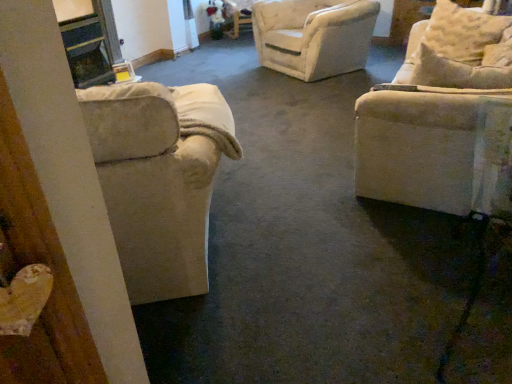
Question: Should I look upward or downward to see beige fabric pillow at upper right?

Choices:
 (A) up
 (B) down

Answer: (A)

Question: Can you confirm if beige fabric couch at right, positioned as the second chair in left-to-right order, is wider than beige fabric pillow at upper right?

Choices:
 (A) no
 (B) yes

Answer: (A)

Question: Does beige fabric couch at right, acting as the first chair starting from the right, turn towards beige fabric pillow at upper right?

Choices:
 (A) no
 (B) yes

Answer: (B)

Question: Is beige fabric couch at right, positioned as the second chair in left-to-right order, to the left of beige fabric pillow at upper right from the viewer's perspective?

Choices:
 (A) no
 (B) yes

Answer: (B)

Question: From a real-world perspective, is beige fabric couch at right, positioned as the second chair in left-to-right order, on top of beige fabric pillow at upper right?

Choices:
 (A) no
 (B) yes

Answer: (B)

Question: Does beige fabric couch at right, acting as the first chair starting from the right, have a smaller size compared to beige fabric pillow at upper right?

Choices:
 (A) yes
 (B) no

Answer: (A)

Question: Is beige fabric couch at right, positioned as the second chair in left-to-right order, located outside beige fabric pillow at upper right?

Choices:
 (A) yes
 (B) no

Answer: (A)

Question: Can you confirm if beige fabric couch at right, acting as the first chair starting from the right, is wider than beige fabric armchair at left, which is the first chair in left-to-right order?

Choices:
 (A) no
 (B) yes

Answer: (A)

Question: From the image's perspective, is beige fabric couch at right, acting as the first chair starting from the right, on beige fabric armchair at left, marked as the second chair in a right-to-left arrangement?

Choices:
 (A) yes
 (B) no

Answer: (A)

Question: Are beige fabric couch at right, acting as the first chair starting from the right, and beige fabric armchair at left, marked as the second chair in a right-to-left arrangement, located far from each other?

Choices:
 (A) no
 (B) yes

Answer: (B)

Question: Is beige fabric couch at right, positioned as the second chair in left-to-right order, taller than beige fabric armchair at left, which is the first chair in left-to-right order?

Choices:
 (A) yes
 (B) no

Answer: (B)

Question: Is the position of beige fabric couch at right, acting as the first chair starting from the right, more distant than that of beige fabric armchair at left, marked as the second chair in a right-to-left arrangement?

Choices:
 (A) no
 (B) yes

Answer: (B)

Question: Does beige fabric couch at right, acting as the first chair starting from the right, lie in front of beige fabric armchair at left, marked as the second chair in a right-to-left arrangement?

Choices:
 (A) no
 (B) yes

Answer: (A)

Question: From a real-world perspective, is beige fabric armchair at left, which is the first chair in left-to-right order, under beige fabric pillow at upper right?

Choices:
 (A) no
 (B) yes

Answer: (B)